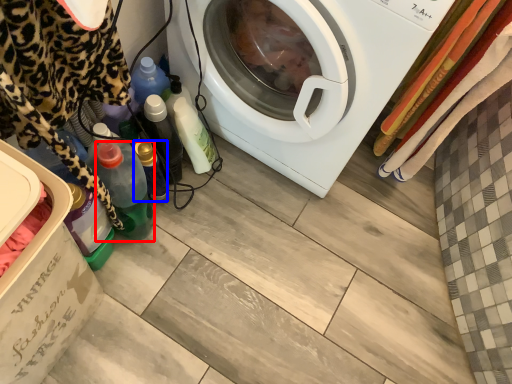
Question: Which object is further to the camera taking this photo, bottle (highlighted by a red box) or bottle (highlighted by a blue box)?

Choices:
 (A) bottle
 (B) bottle

Answer: (B)